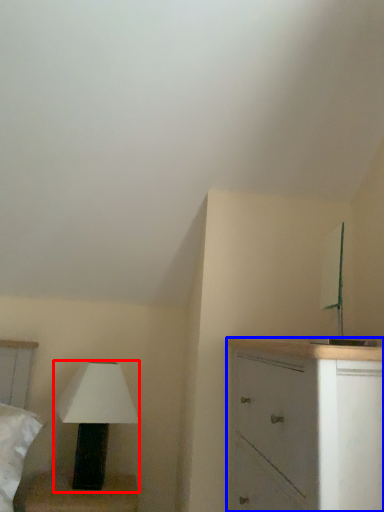
Question: Among these objects, which one is nearest to the camera, lamp (highlighted by a red box) or chest of drawers (highlighted by a blue box)?

Choices:
 (A) lamp
 (B) chest of drawers

Answer: (B)